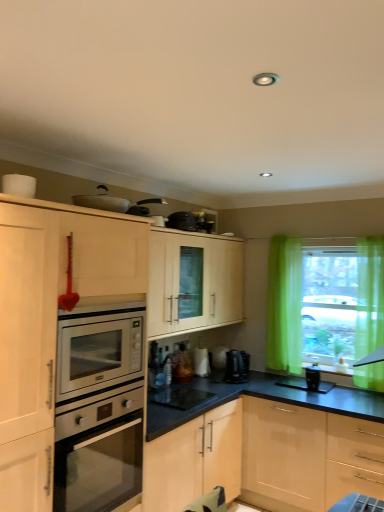
You are a GUI agent. You are given a task and a screenshot of the screen. Output one action in this format:
    pyautogui.click(x=<x>, y=<y>)
    Task: Click on the vacant area that lies between black plastic coffee machine at center and black glossy coffee maker at center, which is the first appliance from bottom to top
    The width and height of the screenshot is (384, 512).
    Given the screenshot: What is the action you would take?
    pyautogui.click(x=224, y=389)